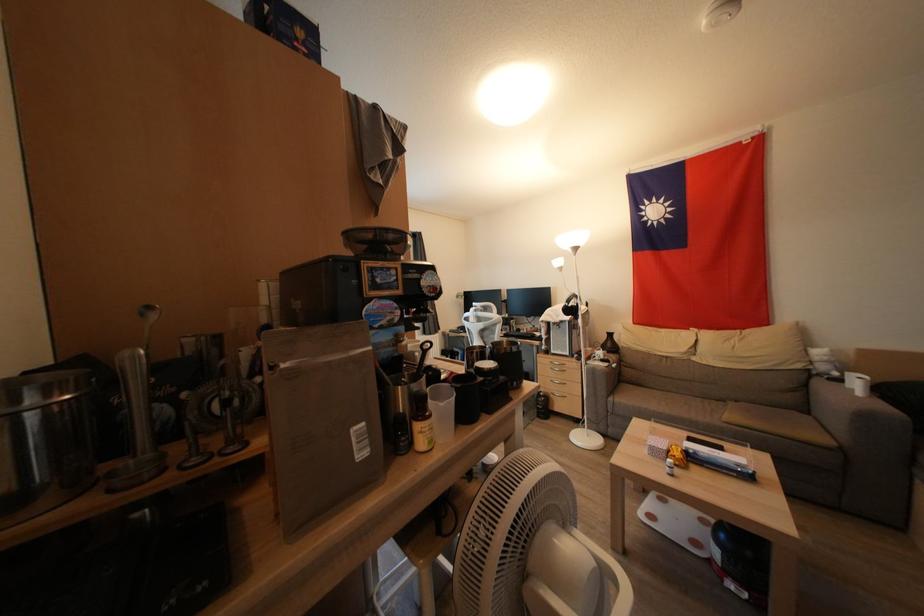
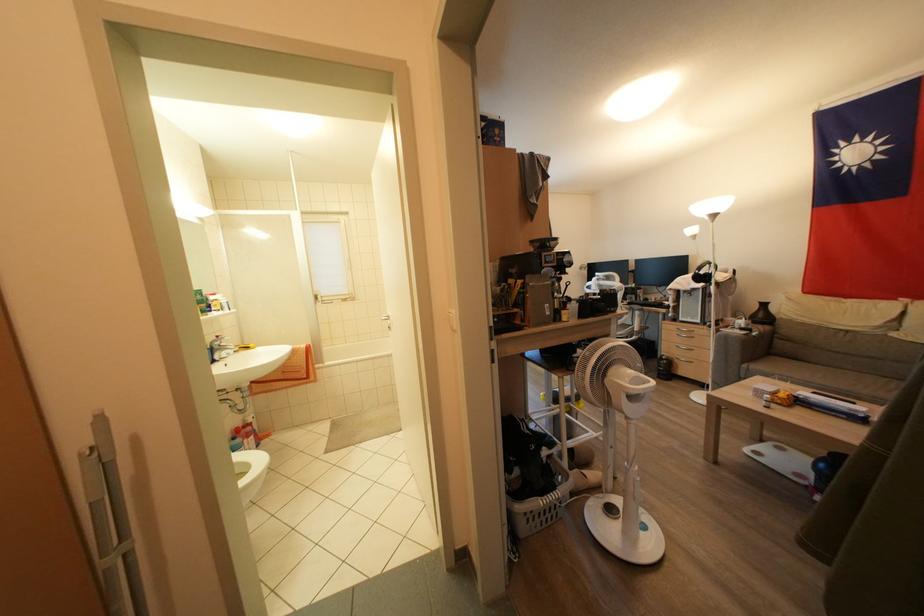
Find the pixel in the second image that matches (x=556, y=355) in the first image.

(686, 323)